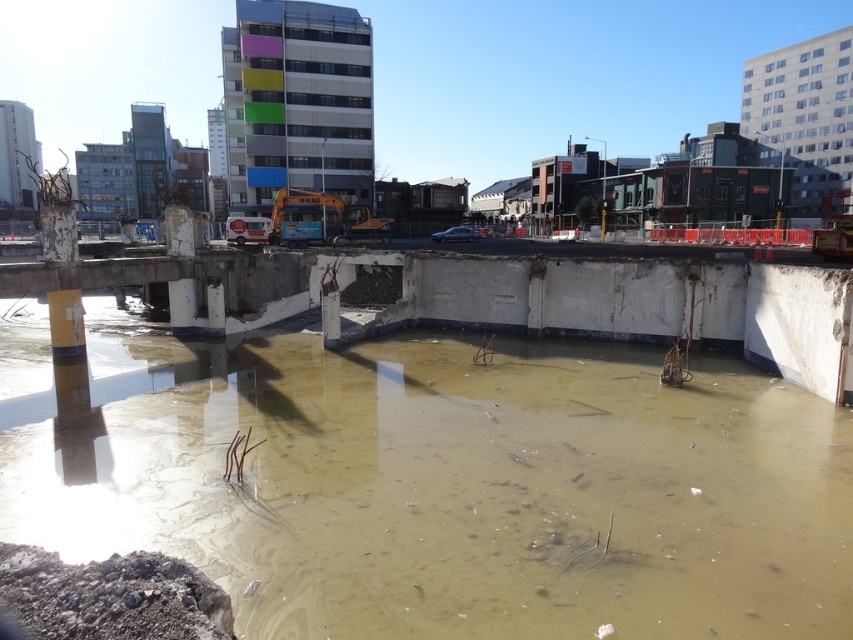
Between muddy concrete water at center and concrete bridge at center, which one is positioned lower?

Answer: muddy concrete water at center is lower down.

This screenshot has height=640, width=853. What do you see at coordinates (440, 483) in the screenshot? I see `muddy concrete water at center` at bounding box center [440, 483].

Identify the location of muddy concrete water at center. The height and width of the screenshot is (640, 853). (440, 483).

Identify the location of muddy concrete water at center. (440, 483).